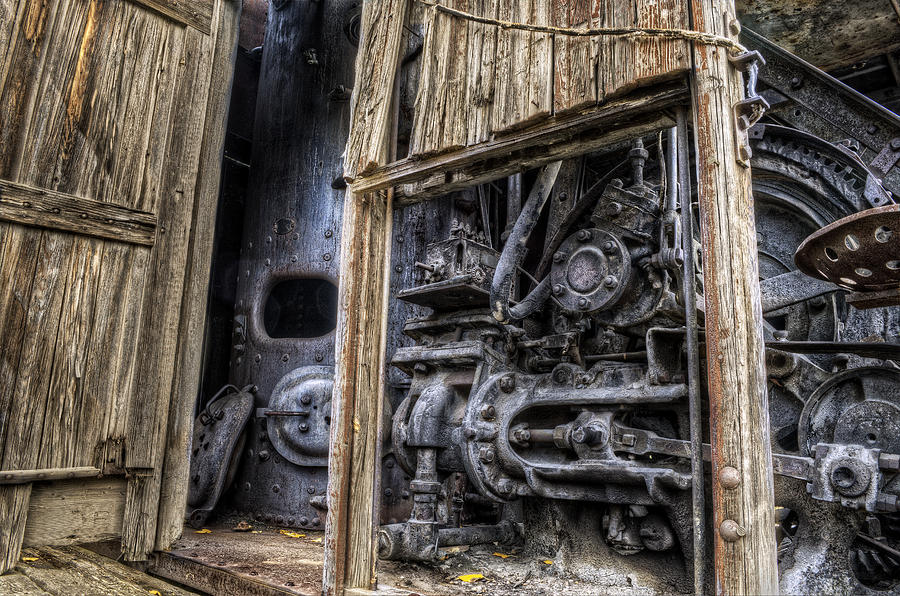
Where is `cement floor`? cement floor is located at coordinates (254, 568).